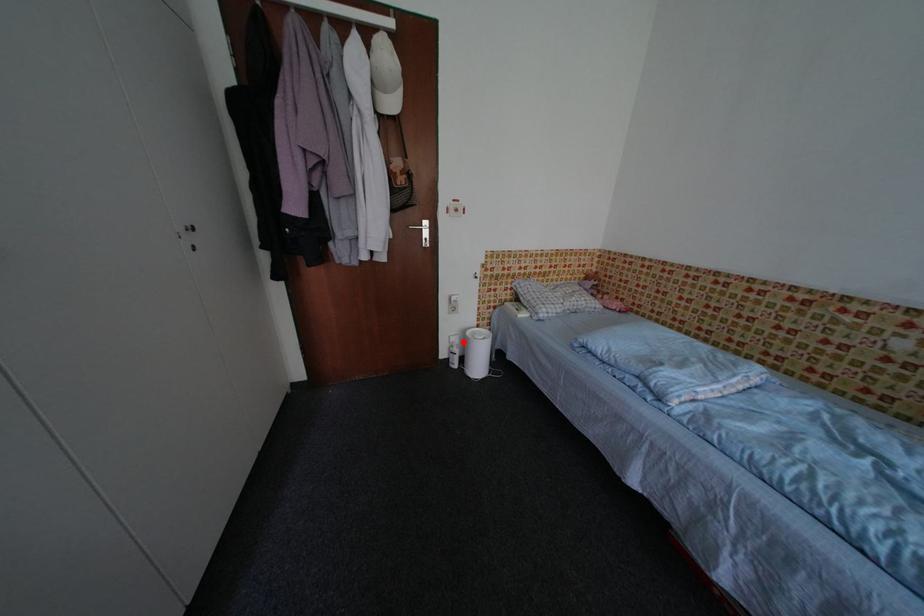
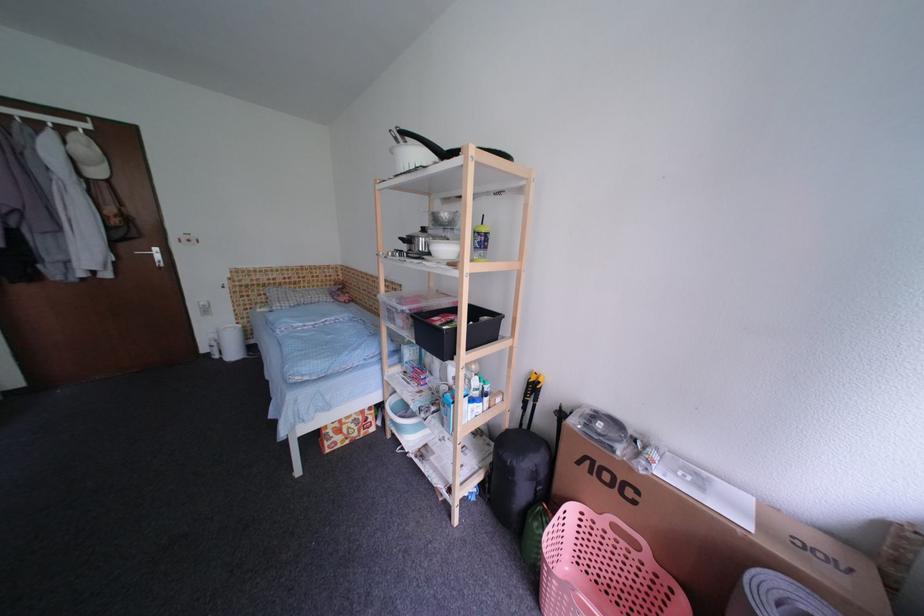
Where in the second image is the point corresponding to the highlighted location from the first image?

(222, 338)